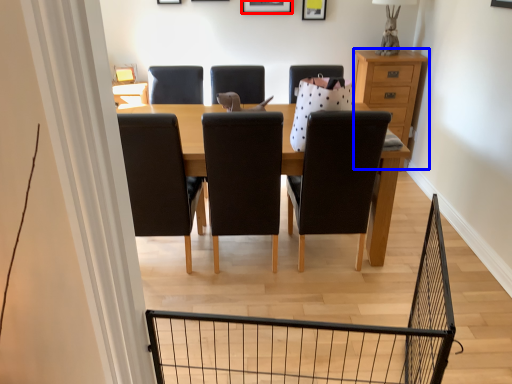
Question: Which object is closer to the camera taking this photo, picture frame (highlighted by a red box) or chest of drawers (highlighted by a blue box)?

Choices:
 (A) picture frame
 (B) chest of drawers

Answer: (B)